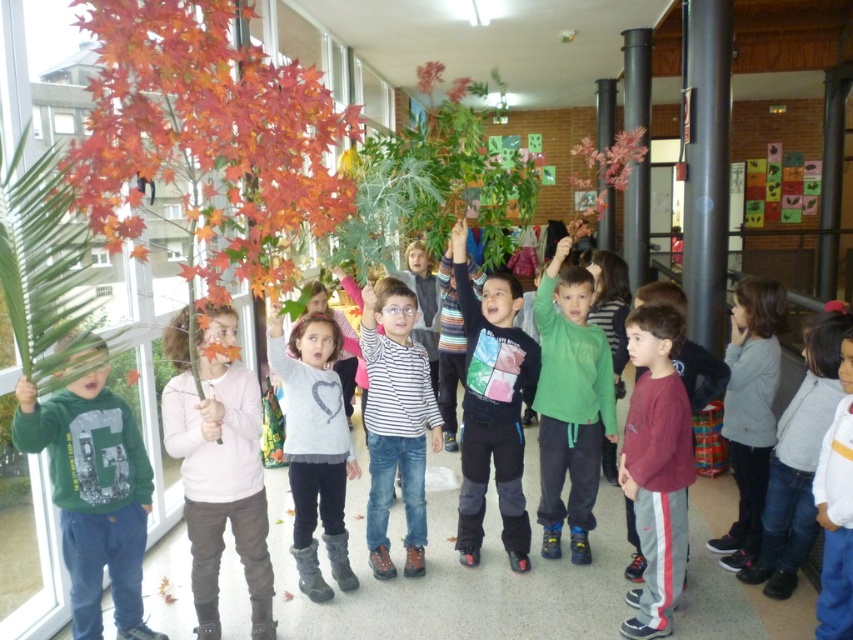
Question: Can you confirm if shiny red leaves at left is positioned above matte red maple leaf at upper right?

Choices:
 (A) yes
 (B) no

Answer: (B)

Question: Can you confirm if maroon fleece at center is thinner than striped shirt at center?

Choices:
 (A) no
 (B) yes

Answer: (B)

Question: Which of the following is the closest to the observer?

Choices:
 (A) (109, 204)
 (B) (683, 472)
 (C) (73, 508)

Answer: (A)

Question: Does shiny red leaves at left lie behind maroon fleece at center?

Choices:
 (A) no
 (B) yes

Answer: (A)

Question: Which of these objects is positioned farthest from the multicolored striped sweater at center?

Choices:
 (A) maroon fleece at center
 (B) green leafy plant at center
 (C) white cotton shirt at center
 (D) white fuzzy sweater at center

Answer: (B)

Question: Which point is closer to the camera?

Choices:
 (A) gray fleece jacket at right
 (B) green leafy plant at center

Answer: (B)